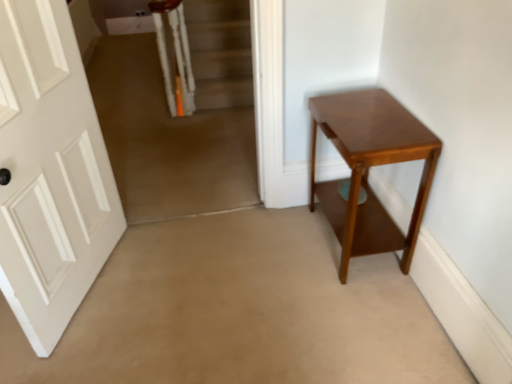
Question: Can you confirm if white matte door at left is shorter than shiny brown table at right?

Choices:
 (A) yes
 (B) no

Answer: (B)

Question: Is white matte door at left at the right side of shiny brown table at right?

Choices:
 (A) no
 (B) yes

Answer: (A)

Question: From the image's perspective, is white matte door at left beneath shiny brown table at right?

Choices:
 (A) no
 (B) yes

Answer: (A)

Question: Can you see white matte door at left touching shiny brown table at right?

Choices:
 (A) yes
 (B) no

Answer: (B)

Question: Considering the relative positions of white matte door at left and shiny brown table at right in the image provided, is white matte door at left in front of shiny brown table at right?

Choices:
 (A) no
 (B) yes

Answer: (B)

Question: Is white matte door at left wider than shiny brown table at right?

Choices:
 (A) yes
 (B) no

Answer: (B)

Question: Is carpeted stairs at upper left smaller than shiny brown table at right?

Choices:
 (A) no
 (B) yes

Answer: (A)

Question: Does carpeted stairs at upper left turn towards shiny brown table at right?

Choices:
 (A) no
 (B) yes

Answer: (A)

Question: Does carpeted stairs at upper left lie in front of shiny brown table at right?

Choices:
 (A) no
 (B) yes

Answer: (A)

Question: From the image's perspective, is carpeted stairs at upper left located above shiny brown table at right?

Choices:
 (A) no
 (B) yes

Answer: (B)

Question: Is carpeted stairs at upper left with shiny brown table at right?

Choices:
 (A) yes
 (B) no

Answer: (B)

Question: Can you confirm if carpeted stairs at upper left is positioned to the right of shiny brown table at right?

Choices:
 (A) yes
 (B) no

Answer: (B)

Question: Is white matte door at left at the back of shiny brown table at right?

Choices:
 (A) no
 (B) yes

Answer: (A)